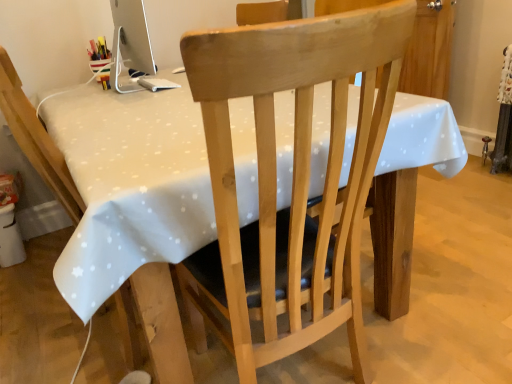
Question: Can you confirm if white glossy computer monitor at upper left is positioned to the right of white dotted tablecloth at center?

Choices:
 (A) yes
 (B) no

Answer: (B)

Question: Is white glossy computer monitor at upper left not within white dotted tablecloth at center?

Choices:
 (A) no
 (B) yes

Answer: (B)

Question: From a real-world perspective, does white glossy computer monitor at upper left stand above white dotted tablecloth at center?

Choices:
 (A) no
 (B) yes

Answer: (B)

Question: Does white glossy computer monitor at upper left lie behind white dotted tablecloth at center?

Choices:
 (A) yes
 (B) no

Answer: (A)

Question: From the image's perspective, would you say white glossy computer monitor at upper left is positioned over white dotted tablecloth at center?

Choices:
 (A) yes
 (B) no

Answer: (A)

Question: Considering the positions of point (163, 266) and point (65, 144), is point (163, 266) closer or farther from the camera than point (65, 144)?

Choices:
 (A) farther
 (B) closer

Answer: (B)

Question: From a real-world perspective, is light wood chair at center, which is the 1th chair from left to right, physically located above or below white dotted tablecloth at center?

Choices:
 (A) below
 (B) above

Answer: (B)

Question: Considering the positions of light wood chair at center, which is the 1th chair from left to right, and white dotted tablecloth at center in the image, is light wood chair at center, which is the 1th chair from left to right, bigger or smaller than white dotted tablecloth at center?

Choices:
 (A) small
 (B) big

Answer: (A)

Question: In the image, is light wood chair at center, the 2th chair positioned from the right, on the left side or the right side of white dotted tablecloth at center?

Choices:
 (A) right
 (B) left

Answer: (B)

Question: From the image's perspective, relative to white glossy computer monitor at upper left, is light wood chair at center, the 2th chair positioned from the right, above or below?

Choices:
 (A) above
 (B) below

Answer: (B)

Question: In the image, is light wood chair at center, the 2th chair positioned from the right, positioned in front of or behind white glossy computer monitor at upper left?

Choices:
 (A) behind
 (B) front

Answer: (B)

Question: Considering the positions of light wood chair at center, which is the 1th chair from left to right, and white glossy computer monitor at upper left in the image, is light wood chair at center, which is the 1th chair from left to right, taller or shorter than white glossy computer monitor at upper left?

Choices:
 (A) short
 (B) tall

Answer: (B)

Question: Is light wood chair at center, which is the 1th chair from left to right, inside or outside of white glossy computer monitor at upper left?

Choices:
 (A) inside
 (B) outside

Answer: (B)

Question: From the image's perspective, is natural wood chair at center, the first chair from the right, located above or below white glossy computer monitor at upper left?

Choices:
 (A) below
 (B) above

Answer: (A)

Question: Is natural wood chair at center, the first chair from the right, situated inside white glossy computer monitor at upper left or outside?

Choices:
 (A) outside
 (B) inside

Answer: (A)